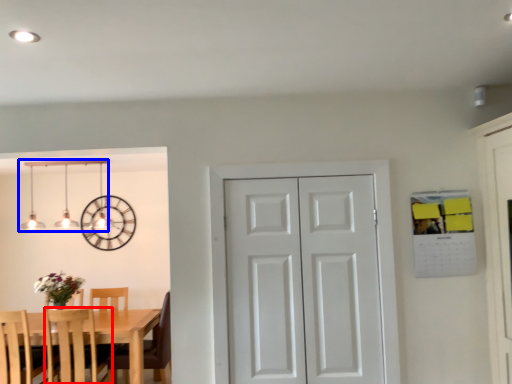
Question: Among these objects, which one is farthest to the camera, chair (highlighted by a red box) or lamp (highlighted by a blue box)?

Choices:
 (A) chair
 (B) lamp

Answer: (B)